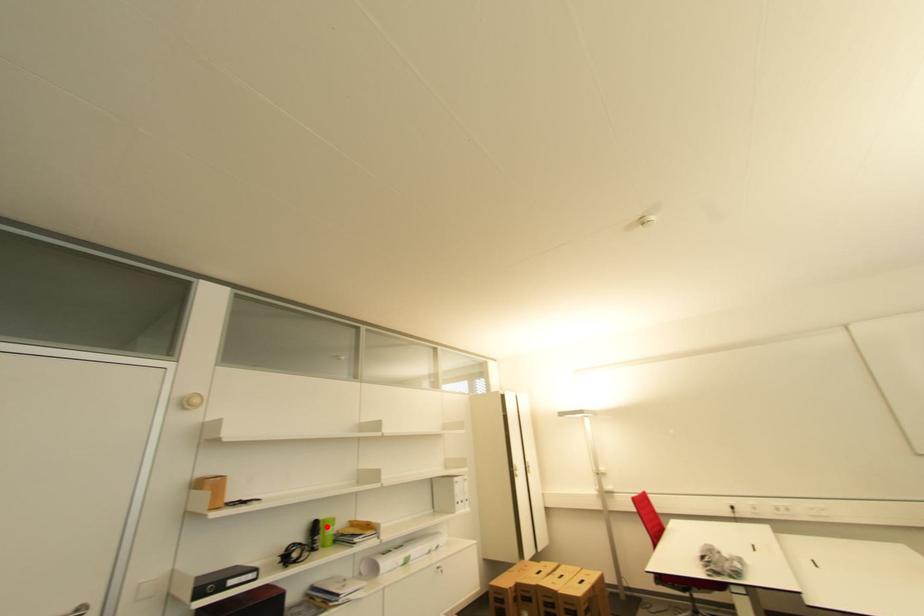
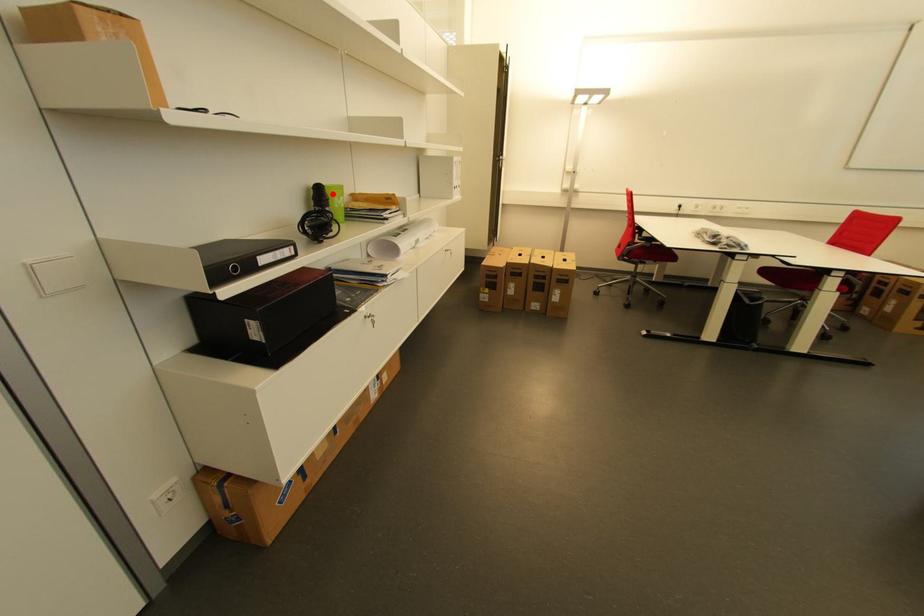
I am providing you with two images of the same scene from different viewpoints. A red point is marked on the first image and another point is marked on the second image. Do the highlighted points in image1 and image2 indicate the same real-world spot?

Yes